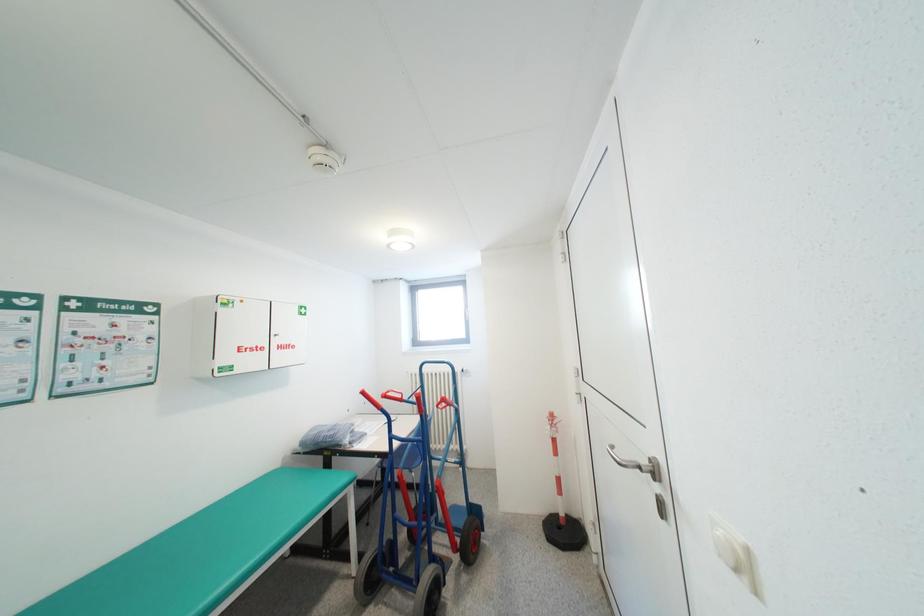
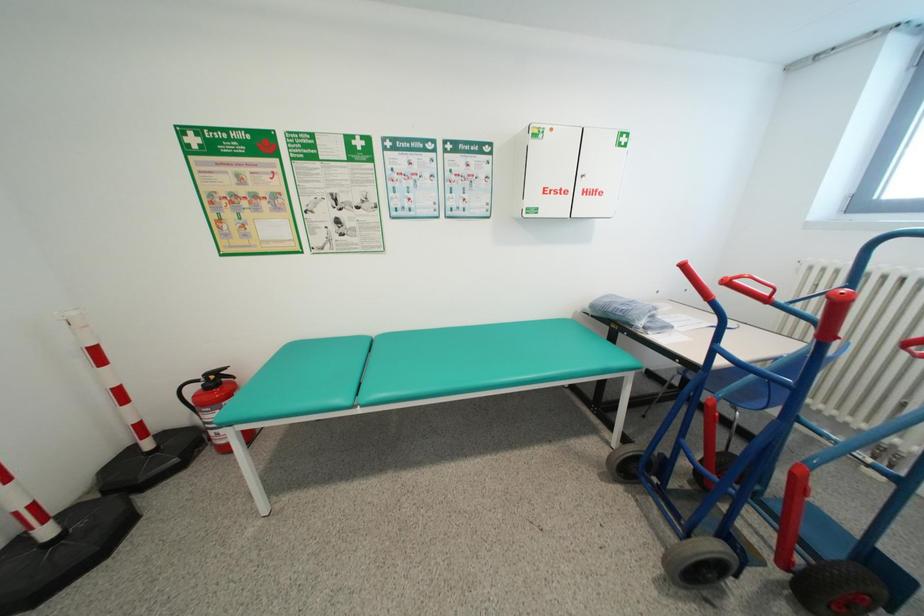
First-person continuous shooting, in which direction is the camera rotating?

The rotation direction of the camera is left-down.